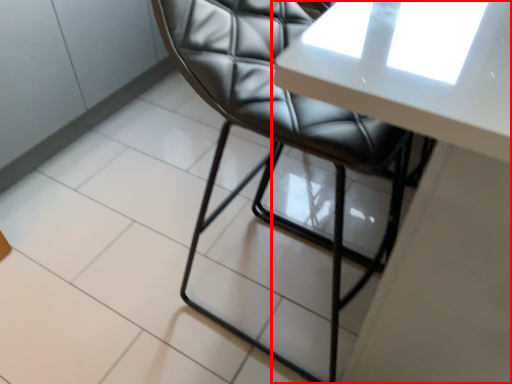
Question: From the image's perspective, what is the correct spatial relationship of table (annotated by the red box) in relation to chair?

Choices:
 (A) above
 (B) below

Answer: (A)